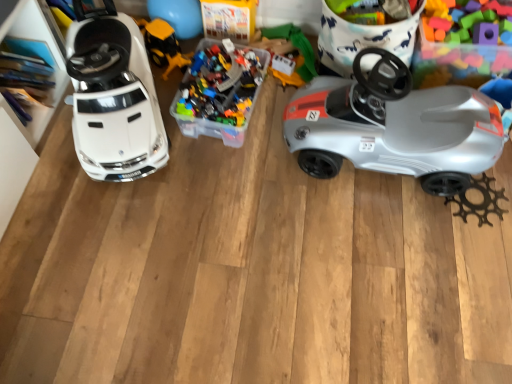
Question: From a real-world perspective, is translucent plastic container at center, arranged as the 2th toy when viewed from the right, beneath yellow plastic construction vehicle at center, which ranks as the 2th toy in left-to-right order?

Choices:
 (A) yes
 (B) no

Answer: (B)

Question: Can you confirm if translucent plastic container at center, arranged as the 2th toy when viewed from the right, is shorter than yellow plastic construction vehicle at center, which ranks as the 2th toy in left-to-right order?

Choices:
 (A) yes
 (B) no

Answer: (B)

Question: Can you confirm if translucent plastic container at center, positioned as the 3th toy in left-to-right order, is thinner than yellow plastic construction vehicle at center, which ranks as the 2th toy in left-to-right order?

Choices:
 (A) no
 (B) yes

Answer: (A)

Question: Considering the relative sizes of translucent plastic container at center, positioned as the 3th toy in left-to-right order, and yellow plastic construction vehicle at center, which ranks as the 2th toy in left-to-right order, in the image provided, is translucent plastic container at center, positioned as the 3th toy in left-to-right order, bigger than yellow plastic construction vehicle at center, which ranks as the 2th toy in left-to-right order,?

Choices:
 (A) no
 (B) yes

Answer: (B)

Question: Is translucent plastic container at center, arranged as the 2th toy when viewed from the right, smaller than yellow plastic construction vehicle at center, positioned as the third toy in right-to-left order?

Choices:
 (A) no
 (B) yes

Answer: (A)

Question: Looking at their shapes, would you say white glossy car at left, the 1th toy from the left, is wider or thinner than translucent plastic blocks at upper right, the fourth toy in the left-to-right sequence?

Choices:
 (A) thin
 (B) wide

Answer: (B)

Question: In the image, is white glossy car at left, the 4th toy viewed from the right, positioned in front of or behind translucent plastic blocks at upper right, positioned as the 1th toy in right-to-left order?

Choices:
 (A) behind
 (B) front

Answer: (B)

Question: In the image, is white glossy car at left, the 1th toy from the left, on the left side or the right side of translucent plastic blocks at upper right, the fourth toy in the left-to-right sequence?

Choices:
 (A) right
 (B) left

Answer: (B)

Question: Does point (77, 38) appear closer or farther from the camera than point (462, 29)?

Choices:
 (A) farther
 (B) closer

Answer: (B)

Question: Visually, is yellow plastic construction vehicle at center, which ranks as the 2th toy in left-to-right order, positioned to the left or to the right of translucent plastic blocks at upper right, positioned as the 1th toy in right-to-left order?

Choices:
 (A) left
 (B) right

Answer: (A)

Question: Considering the positions of yellow plastic construction vehicle at center, positioned as the third toy in right-to-left order, and translucent plastic blocks at upper right, positioned as the 1th toy in right-to-left order, in the image, is yellow plastic construction vehicle at center, positioned as the third toy in right-to-left order, taller or shorter than translucent plastic blocks at upper right, positioned as the 1th toy in right-to-left order,?

Choices:
 (A) short
 (B) tall

Answer: (A)

Question: From a real-world perspective, is yellow plastic construction vehicle at center, positioned as the third toy in right-to-left order, physically located above or below translucent plastic blocks at upper right, positioned as the 1th toy in right-to-left order?

Choices:
 (A) below
 (B) above

Answer: (A)

Question: In terms of width, does yellow plastic construction vehicle at center, which ranks as the 2th toy in left-to-right order, look wider or thinner when compared to translucent plastic blocks at upper right, positioned as the 1th toy in right-to-left order?

Choices:
 (A) thin
 (B) wide

Answer: (A)

Question: From the image's perspective, relative to translucent plastic container at center, positioned as the 3th toy in left-to-right order, is silver plastic car at right above or below?

Choices:
 (A) above
 (B) below

Answer: (B)

Question: Looking at the image, does silver plastic car at right seem bigger or smaller compared to translucent plastic container at center, arranged as the 2th toy when viewed from the right?

Choices:
 (A) small
 (B) big

Answer: (B)